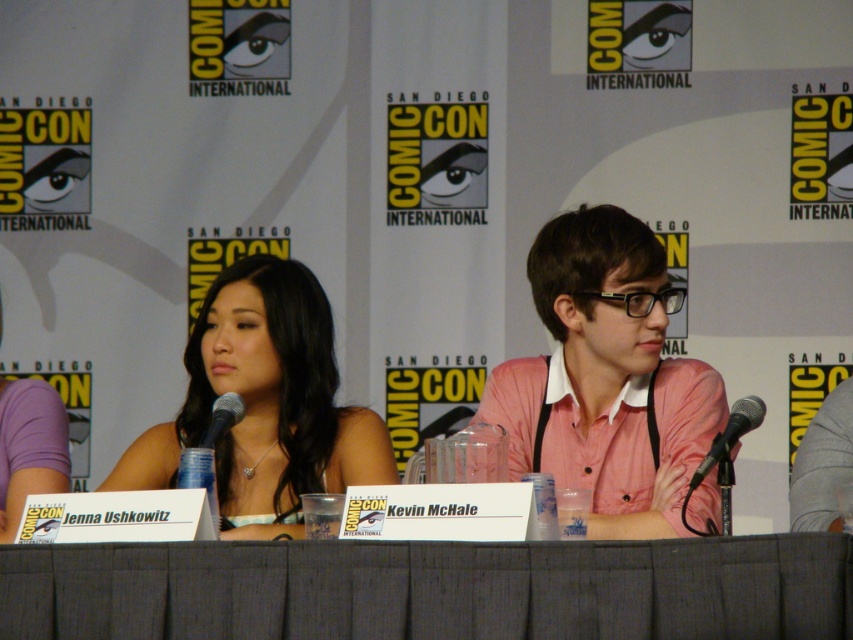
You are attending a panel discussion at ComicCon. You see a gray fabric table at center and a pink cotton shirt at center. Which object is closer to the bottom of the image?

The gray fabric table at center is closer to the bottom of the image because it is positioned below the pink cotton shirt at center.

You are an attendee at Comic Con and you want to take a photo of the matte black dress at center. Where should you position yourself to get the best shot?

To capture the matte black dress at center, position yourself directly in front of it at the point specified by coordinates 0.633 on the x axis and 0.311 on the y axis.